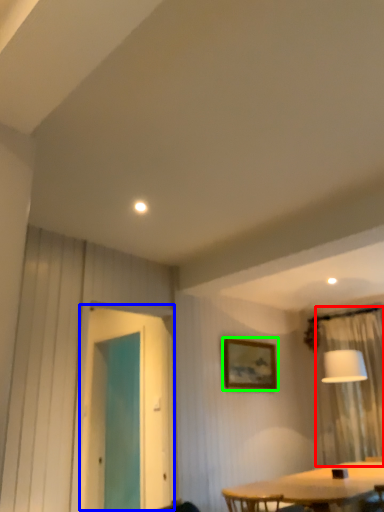
Question: Which object is the farthest from curtain (highlighted by a red box)? Choose among these: screen door (highlighted by a blue box) or picture frame (highlighted by a green box).

Choices:
 (A) screen door
 (B) picture frame

Answer: (A)